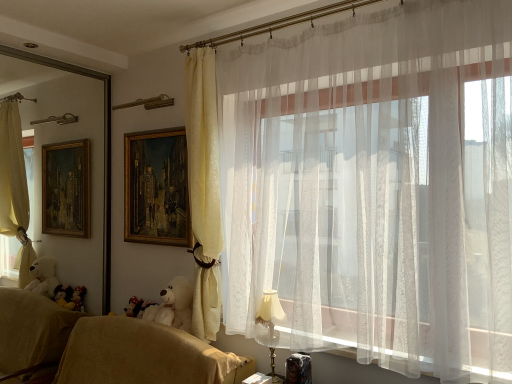
Question: Is matte gold table lamp at lower right in contact with matte yellow curtain at center, which is counted as the second curtain, starting from the right?

Choices:
 (A) yes
 (B) no

Answer: (B)

Question: Is there a large distance between matte gold table lamp at lower right and matte yellow curtain at center, which is counted as the second curtain, starting from the right?

Choices:
 (A) yes
 (B) no

Answer: (B)

Question: Is matte gold table lamp at lower right facing towards matte yellow curtain at center, the first curtain viewed from the left?

Choices:
 (A) yes
 (B) no

Answer: (B)

Question: From the image's perspective, is matte gold table lamp at lower right above matte yellow curtain at center, which is counted as the second curtain, starting from the right?

Choices:
 (A) yes
 (B) no

Answer: (B)

Question: Can you confirm if matte gold table lamp at lower right is taller than matte yellow curtain at center, the first curtain viewed from the left?

Choices:
 (A) yes
 (B) no

Answer: (B)

Question: Is the depth of matte gold table lamp at lower right less than that of matte yellow curtain at center, which is counted as the second curtain, starting from the right?

Choices:
 (A) no
 (B) yes

Answer: (B)

Question: Does matte yellow curtain at center, which is counted as the second curtain, starting from the right, appear on the left side of gold wooden picture frame at upper center?

Choices:
 (A) yes
 (B) no

Answer: (B)

Question: From a real-world perspective, is matte yellow curtain at center, the first curtain viewed from the left, over gold wooden picture frame at upper center?

Choices:
 (A) yes
 (B) no

Answer: (B)

Question: Is matte yellow curtain at center, which is counted as the second curtain, starting from the right, in contact with gold wooden picture frame at upper center?

Choices:
 (A) yes
 (B) no

Answer: (B)

Question: Is matte yellow curtain at center, which is counted as the second curtain, starting from the right, positioned beyond the bounds of gold wooden picture frame at upper center?

Choices:
 (A) no
 (B) yes

Answer: (B)

Question: Is matte yellow curtain at center, the first curtain viewed from the left, shorter than gold wooden picture frame at upper center?

Choices:
 (A) yes
 (B) no

Answer: (B)

Question: From a real-world perspective, does matte yellow curtain at center, which is counted as the second curtain, starting from the right, sit lower than gold wooden picture frame at upper center?

Choices:
 (A) yes
 (B) no

Answer: (A)

Question: Is white plush bear at lower left bigger than white sheer curtain at upper right, the 2th curtain from the left?

Choices:
 (A) no
 (B) yes

Answer: (A)